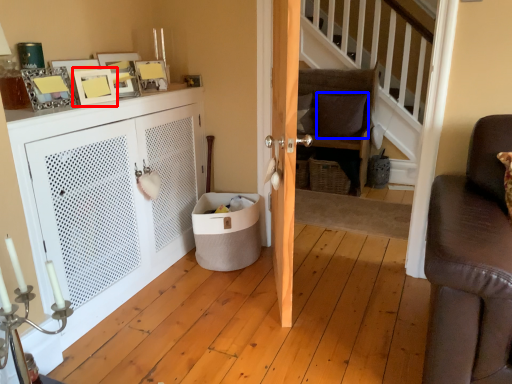
Question: Which point is closer to the camera, picture frame (highlighted by a red box) or pillow (highlighted by a blue box)?

Choices:
 (A) picture frame
 (B) pillow

Answer: (A)